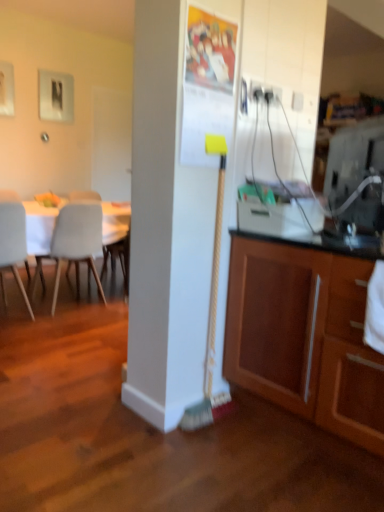
Find the location of a particular element. This screenshot has width=384, height=512. free space to the left of wooden cabinet at lower right is located at coordinates (175, 444).